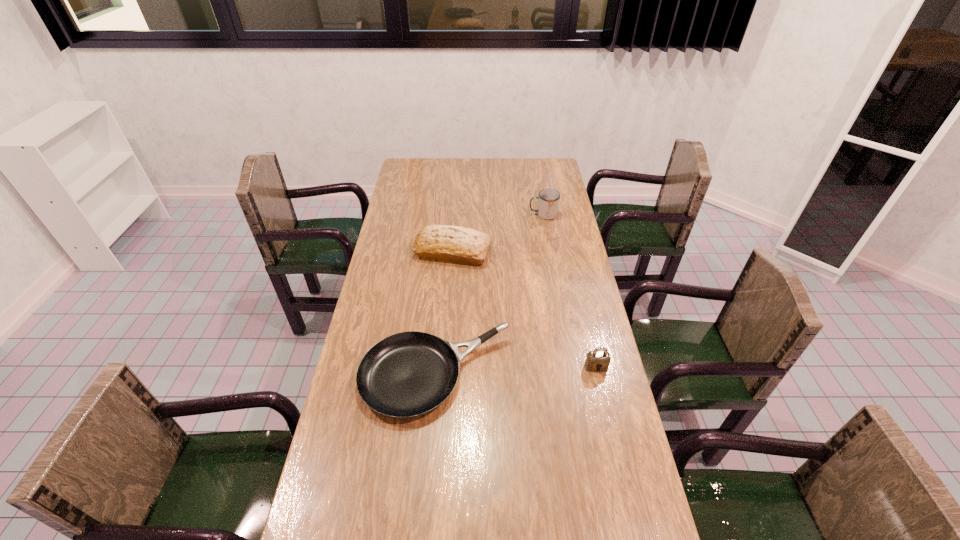
You are a GUI agent. You are given a task and a screenshot of the screen. Output one action in this format:
    pyautogui.click(x=<x>, y=<y>)
    Task: Click on the third nearest object
    
    Given the screenshot: What is the action you would take?
    pyautogui.click(x=453, y=244)

Locate an element on the screen. This screenshot has width=960, height=540. the farthest object is located at coordinates (548, 203).

Where is `padlock`? This screenshot has width=960, height=540. padlock is located at coordinates (598, 360).

This screenshot has width=960, height=540. I want to click on pan, so click(407, 374).

The height and width of the screenshot is (540, 960). Find the location of `free region located on the right of the bread`. free region located on the right of the bread is located at coordinates (556, 252).

Identify the location of vacant point located 0.260m on the handle side of the mug. The image size is (960, 540). (469, 215).

The height and width of the screenshot is (540, 960). I want to click on vacant area situated 0.250m on the handle side of the mug, so click(x=472, y=215).

Identify the location of free space located 0.290m on the handle side of the mug. (463, 215).

Find the location of a particular element. vacant space situated 0.300m at the front of the padlock near the keyhole is located at coordinates (620, 472).

This screenshot has width=960, height=540. I want to click on vacant area situated on the back of the pan, so click(x=442, y=300).